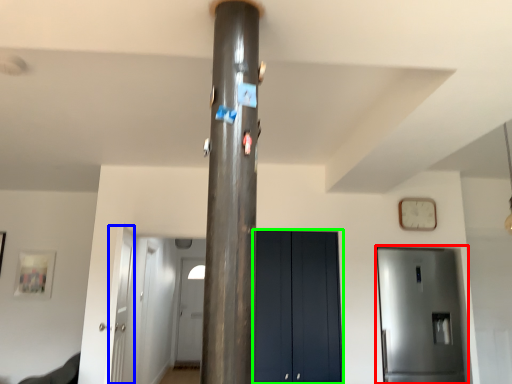
Question: Which object is positioned farthest from door (highlighted by a red box)? Select from door (highlighted by a blue box) and door (highlighted by a green box).

Choices:
 (A) door
 (B) door

Answer: (A)